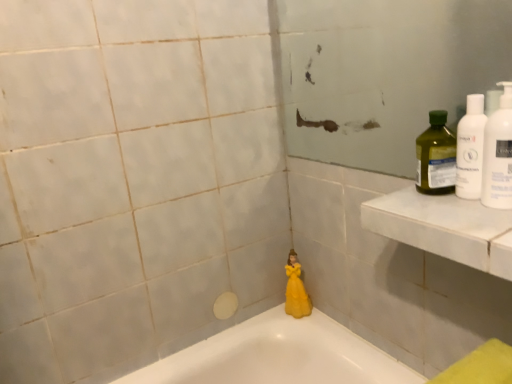
Question: Does yellow matte figurine at center appear on the left side of white plastic bottle at upper right, the 3th cleaning product in the back-to-front sequence?

Choices:
 (A) yes
 (B) no

Answer: (A)

Question: From the image's perspective, is yellow matte figurine at center above white plastic bottle at upper right, the first cleaning product in the front-to-back sequence?

Choices:
 (A) no
 (B) yes

Answer: (A)

Question: Does yellow matte figurine at center have a greater height compared to white plastic bottle at upper right, the first cleaning product in the front-to-back sequence?

Choices:
 (A) no
 (B) yes

Answer: (B)

Question: Is the position of yellow matte figurine at center more distant than that of white plastic bottle at upper right, the 3th cleaning product in the back-to-front sequence?

Choices:
 (A) yes
 (B) no

Answer: (A)

Question: Is there a large distance between yellow matte figurine at center and white plastic bottle at upper right, the first cleaning product in the front-to-back sequence?

Choices:
 (A) yes
 (B) no

Answer: (B)

Question: From the image's perspective, would you say yellow matte figurine at center is shown under white plastic bottle at upper right, the 3th cleaning product in the back-to-front sequence?

Choices:
 (A) no
 (B) yes

Answer: (B)

Question: Is the position of white plastic bottle at upper right, the first cleaning product in the front-to-back sequence, less distant than that of yellow matte figurine at center?

Choices:
 (A) yes
 (B) no

Answer: (A)

Question: Is white plastic bottle at upper right, the first cleaning product in the front-to-back sequence, shorter than yellow matte figurine at center?

Choices:
 (A) no
 (B) yes

Answer: (B)

Question: Does white plastic bottle at upper right, the first cleaning product in the front-to-back sequence, have a smaller size compared to yellow matte figurine at center?

Choices:
 (A) yes
 (B) no

Answer: (A)

Question: Can you confirm if white plastic bottle at upper right, the first cleaning product in the front-to-back sequence, is taller than yellow matte figurine at center?

Choices:
 (A) yes
 (B) no

Answer: (B)

Question: From a real-world perspective, is white plastic bottle at upper right, the first cleaning product in the front-to-back sequence, positioned over yellow matte figurine at center based on gravity?

Choices:
 (A) no
 (B) yes

Answer: (B)

Question: Is white plastic bottle at upper right, the 3th cleaning product in the back-to-front sequence, at the right side of yellow matte figurine at center?

Choices:
 (A) yes
 (B) no

Answer: (A)

Question: Can you confirm if white marble ledge at upper right is bigger than yellow matte figurine at center?

Choices:
 (A) yes
 (B) no

Answer: (A)